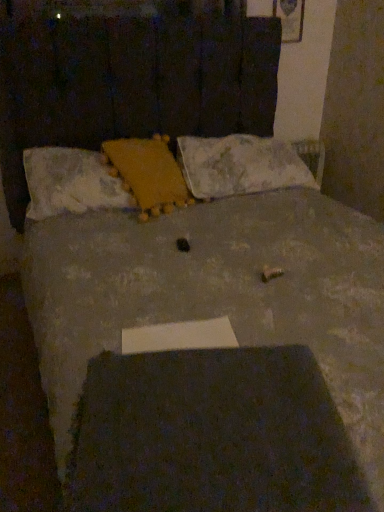
This screenshot has height=512, width=384. I want to click on yellow fuzzy pillow at upper center, acting as the second pillow starting from the left, so click(x=148, y=173).

Describe the element at coordinates (71, 183) in the screenshot. I see `fluffy white pillow at upper left, which is the first pillow in left-to-right order` at that location.

Locate an element on the screen. The image size is (384, 512). yellow fuzzy pillow at upper center, placed as the 2th pillow when sorted from right to left is located at coordinates (148, 173).

How different are the orientations of white soft pillow at center, the 3th pillow when ordered from left to right, and yellow fuzzy pillow at upper center, acting as the second pillow starting from the left, in degrees?

The angular difference between white soft pillow at center, the 3th pillow when ordered from left to right, and yellow fuzzy pillow at upper center, acting as the second pillow starting from the left, is 18.1 degrees.

Which point is more forward, (x=215, y=159) or (x=152, y=183)?

Positioned in front is point (x=152, y=183).

Does white soft pillow at center, the 1th pillow in the right-to-left sequence, turn towards yellow fuzzy pillow at upper center, placed as the 2th pillow when sorted from right to left?

No, white soft pillow at center, the 1th pillow in the right-to-left sequence, is not oriented towards yellow fuzzy pillow at upper center, placed as the 2th pillow when sorted from right to left.

Which pillow is the 1st one when counting from the left side of the white soft pillow at center, the 3th pillow when ordered from left to right? Please provide its 2D coordinates.

[(148, 173)]

Which is behind, white soft pillow at center, the 3th pillow when ordered from left to right, or fluffy white pillow at upper left, placed as the third pillow when sorted from right to left?

white soft pillow at center, the 3th pillow when ordered from left to right, is behind.

In the scene shown: Is white soft pillow at center, the 3th pillow when ordered from left to right, bigger or smaller than fluffy white pillow at upper left, placed as the third pillow when sorted from right to left?

Considering their sizes, white soft pillow at center, the 3th pillow when ordered from left to right, takes up more space than fluffy white pillow at upper left, placed as the third pillow when sorted from right to left.

Would you say white soft pillow at center, the 3th pillow when ordered from left to right, is outside fluffy white pillow at upper left, which is the first pillow in left-to-right order?

white soft pillow at center, the 3th pillow when ordered from left to right, lies outside fluffy white pillow at upper left, which is the first pillow in left-to-right order,'s area.

Considering the positions of objects white soft pillow at center, the 3th pillow when ordered from left to right, and fluffy white pillow at upper left, which is the first pillow in left-to-right order, in the image provided, who is more to the left, white soft pillow at center, the 3th pillow when ordered from left to right, or fluffy white pillow at upper left, which is the first pillow in left-to-right order,?

Positioned to the left is fluffy white pillow at upper left, which is the first pillow in left-to-right order.

Would you say fluffy white pillow at upper left, which is the first pillow in left-to-right order, is a long distance from yellow fuzzy pillow at upper center, acting as the second pillow starting from the left?

No, fluffy white pillow at upper left, which is the first pillow in left-to-right order, is not far from yellow fuzzy pillow at upper center, acting as the second pillow starting from the left.

Which object is positioned more to the left, fluffy white pillow at upper left, which is the first pillow in left-to-right order, or yellow fuzzy pillow at upper center, acting as the second pillow starting from the left?

Positioned to the left is fluffy white pillow at upper left, which is the first pillow in left-to-right order.

From the picture: Is fluffy white pillow at upper left, placed as the third pillow when sorted from right to left, inside or outside of yellow fuzzy pillow at upper center, acting as the second pillow starting from the left?

fluffy white pillow at upper left, placed as the third pillow when sorted from right to left, is contained in yellow fuzzy pillow at upper center, acting as the second pillow starting from the left.

How many degrees apart are the facing directions of fluffy white pillow at upper left, which is the first pillow in left-to-right order, and yellow fuzzy pillow at upper center, acting as the second pillow starting from the left?

17.5 degrees.

Considering the relative sizes of yellow fuzzy pillow at upper center, acting as the second pillow starting from the left, and fluffy white pillow at upper left, which is the first pillow in left-to-right order, in the image provided, is yellow fuzzy pillow at upper center, acting as the second pillow starting from the left, thinner than fluffy white pillow at upper left, which is the first pillow in left-to-right order,?

Incorrect, the width of yellow fuzzy pillow at upper center, acting as the second pillow starting from the left, is not less than that of fluffy white pillow at upper left, which is the first pillow in left-to-right order.

From the image's perspective, which is below, yellow fuzzy pillow at upper center, acting as the second pillow starting from the left, or fluffy white pillow at upper left, which is the first pillow in left-to-right order?

fluffy white pillow at upper left, which is the first pillow in left-to-right order, from the image's perspective.

Could you tell me if yellow fuzzy pillow at upper center, acting as the second pillow starting from the left, is facing fluffy white pillow at upper left, placed as the third pillow when sorted from right to left?

Yes.

From a real-world perspective, is yellow fuzzy pillow at upper center, placed as the 2th pillow when sorted from right to left, above or below white soft pillow at center, the 1th pillow in the right-to-left sequence?

From a real-world perspective, yellow fuzzy pillow at upper center, placed as the 2th pillow when sorted from right to left, is physically above white soft pillow at center, the 1th pillow in the right-to-left sequence.

Which object is wider, yellow fuzzy pillow at upper center, acting as the second pillow starting from the left, or white soft pillow at center, the 3th pillow when ordered from left to right?

With larger width is white soft pillow at center, the 3th pillow when ordered from left to right.

Considering the points (138, 202) and (235, 149), which point is behind, point (138, 202) or point (235, 149)?

The point (235, 149) is more distant.

Is yellow fuzzy pillow at upper center, placed as the 2th pillow when sorted from right to left, situated inside white soft pillow at center, the 3th pillow when ordered from left to right, or outside?

yellow fuzzy pillow at upper center, placed as the 2th pillow when sorted from right to left, is spatially situated outside white soft pillow at center, the 3th pillow when ordered from left to right.

Between fluffy white pillow at upper left, which is the first pillow in left-to-right order, and white soft pillow at center, the 1th pillow in the right-to-left sequence, which one has larger size?

Bigger between the two is white soft pillow at center, the 1th pillow in the right-to-left sequence.

Can you tell me how much fluffy white pillow at upper left, which is the first pillow in left-to-right order, and white soft pillow at center, the 1th pillow in the right-to-left sequence, differ in facing direction?

fluffy white pillow at upper left, which is the first pillow in left-to-right order, and white soft pillow at center, the 1th pillow in the right-to-left sequence, are facing 0.601 degrees away from each other.

From the picture: From a real-world perspective, is fluffy white pillow at upper left, placed as the third pillow when sorted from right to left, physically located above or below white soft pillow at center, the 3th pillow when ordered from left to right?

From a real-world perspective, fluffy white pillow at upper left, placed as the third pillow when sorted from right to left, is physically above white soft pillow at center, the 3th pillow when ordered from left to right.

Find the location of a particular element. Image resolution: width=384 pixels, height=512 pixels. pillow below the fluffy white pillow at upper left, placed as the third pillow when sorted from right to left (from a real-world perspective) is located at coordinates (240, 165).

Locate an element on the screen. the 2nd pillow directly beneath the yellow fuzzy pillow at upper center, placed as the 2th pillow when sorted from right to left (from a real-world perspective) is located at coordinates (240, 165).

From the image's perspective, starting from the white soft pillow at center, the 1th pillow in the right-to-left sequence, which pillow is the 2nd one below? Please provide its 2D coordinates.

[(71, 183)]

Which object lies further to the anchor point fluffy white pillow at upper left, which is the first pillow in left-to-right order, white soft pillow at center, the 1th pillow in the right-to-left sequence, or yellow fuzzy pillow at upper center, acting as the second pillow starting from the left?

Among the two, white soft pillow at center, the 1th pillow in the right-to-left sequence, is located further to fluffy white pillow at upper left, which is the first pillow in left-to-right order.

Estimate the real-world distances between objects in this image. Which object is further from yellow fuzzy pillow at upper center, acting as the second pillow starting from the left, fluffy white pillow at upper left, which is the first pillow in left-to-right order, or white soft pillow at center, the 3th pillow when ordered from left to right?

white soft pillow at center, the 3th pillow when ordered from left to right.

Which object lies further to the anchor point fluffy white pillow at upper left, which is the first pillow in left-to-right order, yellow fuzzy pillow at upper center, acting as the second pillow starting from the left, or white soft pillow at center, the 1th pillow in the right-to-left sequence?

Among the two, white soft pillow at center, the 1th pillow in the right-to-left sequence, is located further to fluffy white pillow at upper left, which is the first pillow in left-to-right order.

When comparing their distances from white soft pillow at center, the 3th pillow when ordered from left to right, does yellow fuzzy pillow at upper center, placed as the 2th pillow when sorted from right to left, or fluffy white pillow at upper left, which is the first pillow in left-to-right order, seem further?

Among the two, fluffy white pillow at upper left, which is the first pillow in left-to-right order, is located further to white soft pillow at center, the 3th pillow when ordered from left to right.

Looking at the image, which one is located closer to white soft pillow at center, the 3th pillow when ordered from left to right, fluffy white pillow at upper left, placed as the third pillow when sorted from right to left, or yellow fuzzy pillow at upper center, acting as the second pillow starting from the left?

yellow fuzzy pillow at upper center, acting as the second pillow starting from the left, is closer to white soft pillow at center, the 3th pillow when ordered from left to right.

Considering their positions, is white soft pillow at center, the 3th pillow when ordered from left to right, positioned further to yellow fuzzy pillow at upper center, placed as the 2th pillow when sorted from right to left, than fluffy white pillow at upper left, placed as the third pillow when sorted from right to left?

white soft pillow at center, the 3th pillow when ordered from left to right.

Identify the location of pillow situated between fluffy white pillow at upper left, placed as the third pillow when sorted from right to left, and white soft pillow at center, the 3th pillow when ordered from left to right, from left to right. (148, 173).